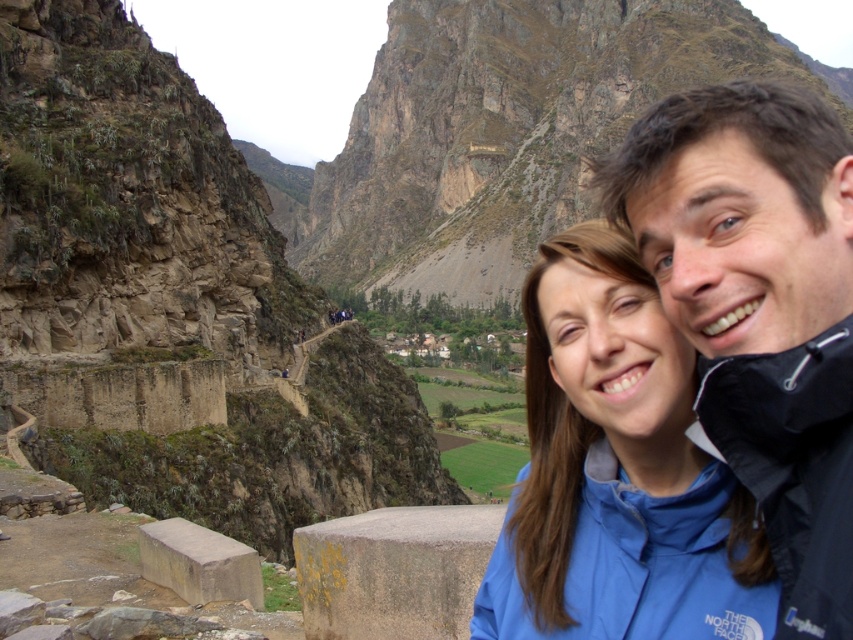
You are a hiker standing at the base of the rugged stone mountain at upper center. You want to reach the summit. Considering the distance, is it feasible to climb the mountain in one day?

The rugged stone mountain at upper center is 206.48 meters away from the viewer. Since this distance is relatively short, it is feasible to climb the mountain in one day if you have proper gear and physical stamina.